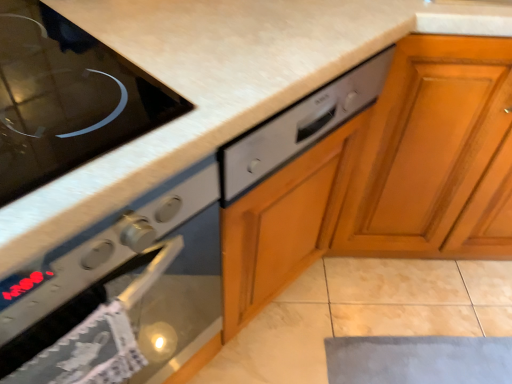
The image size is (512, 384). In order to click on vacant location below satin silver dishwasher at center (from a real-world perspective) in this screenshot , I will do coord(279,314).